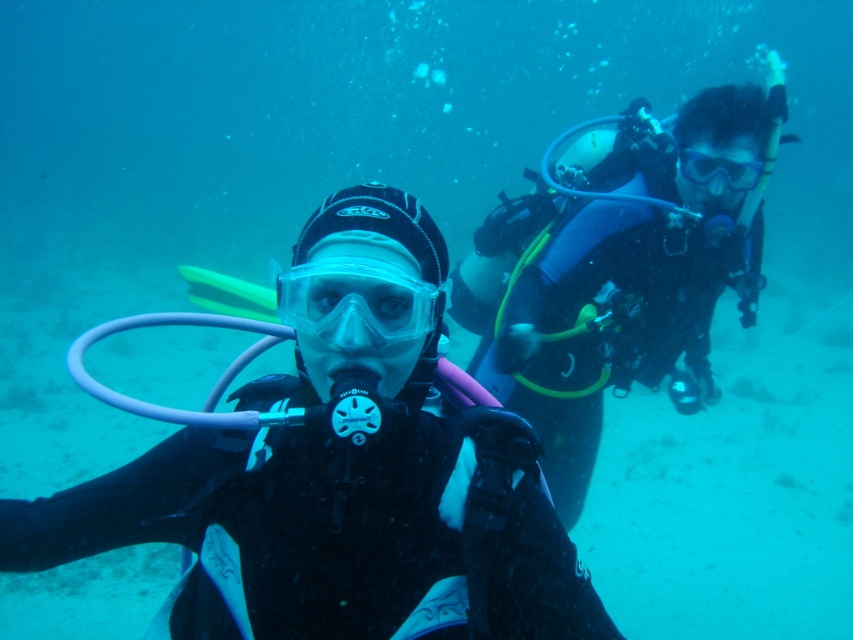
You are a scuba diver underwater and you want to choose a pair of goggles to see better. Which goggles, the transparent plastic goggles at center or the clear plastic goggles at center, would you pick and why?

The clear plastic goggles at center are larger than the transparent plastic goggles at center, so they might provide a wider field of view, making it easier to see underwater.